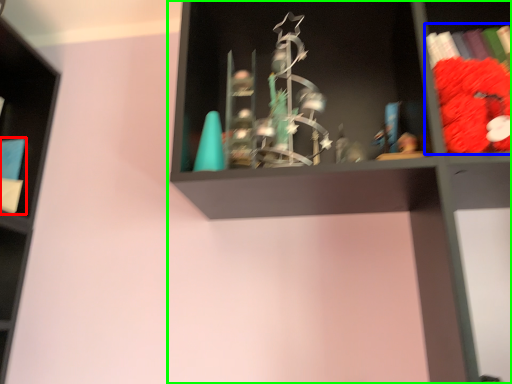
Question: Which object is positioned farthest from book (highlighted by a red box)? Select from book (highlighted by a blue box) and shelf (highlighted by a green box).

Choices:
 (A) book
 (B) shelf

Answer: (A)